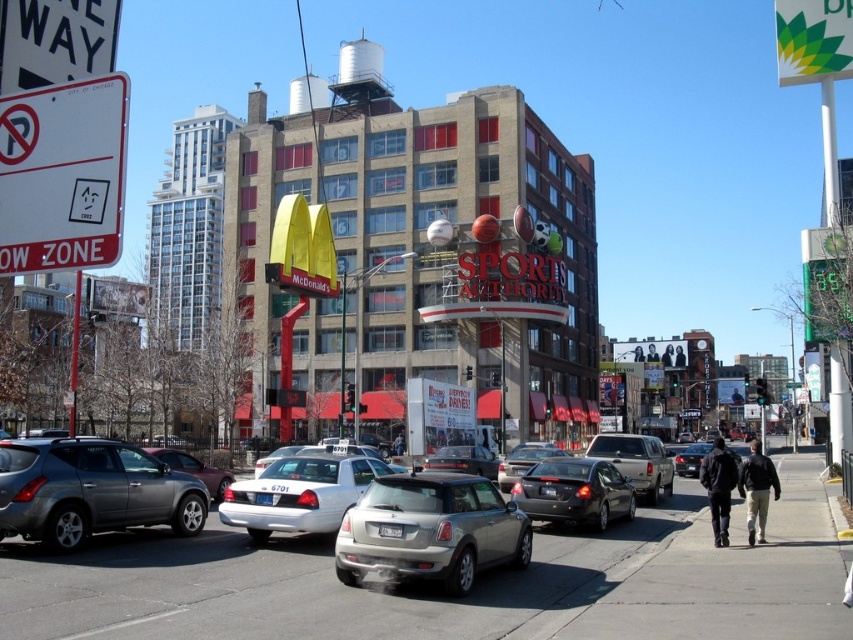
You are a delivery person standing at the edge of the gray asphalt at center. You need to deliver a package to a customer located 30 feet away from your current position. Can you walk directly to the destination without crossing any vehicles?

The gray asphalt at center is 26.03 feet away from camera. Since the destination is 30 feet away, which is beyond the gray asphalt at center, you may need to cross the vehicles or find another path.

You are a delivery person trying to read the white paper sign at left while driving a satin silver car at center. Can you see the entire sign from your current position?

The white paper sign at left is not as tall as the satin silver car at center, so you can see the entire sign from your current position.